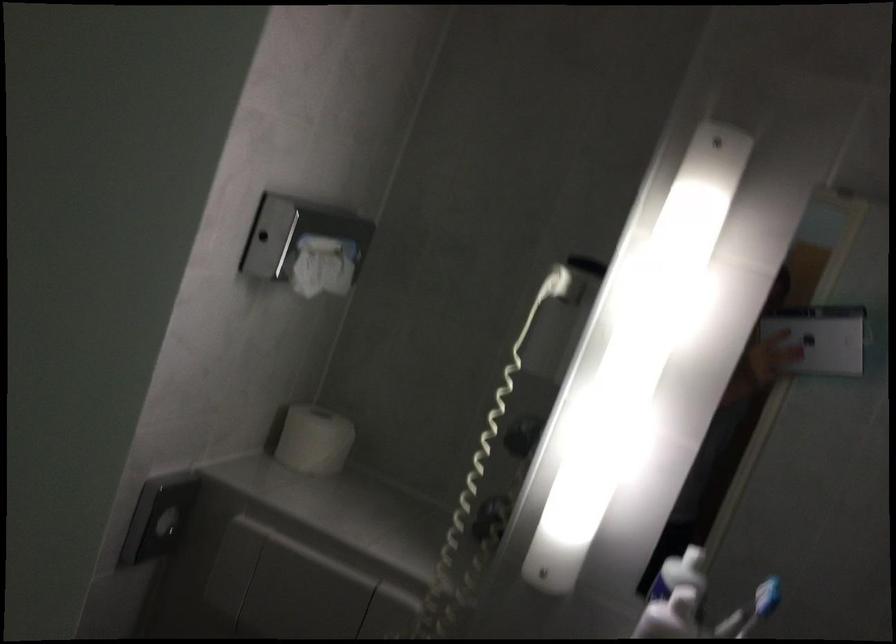
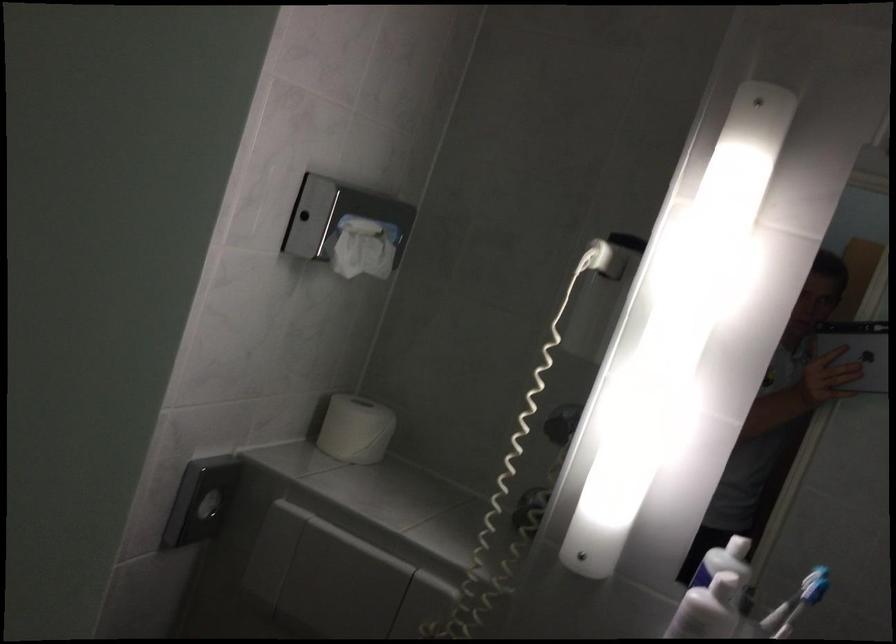
Find the pixel in the second image that matches (314,442) in the first image.

(355, 429)